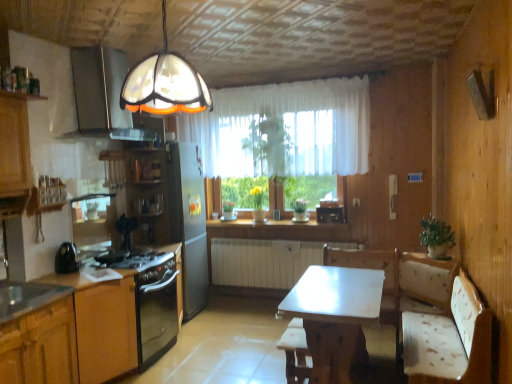
What is the approximate width of white glossy countertop at center?

The width of white glossy countertop at center is 14.56 inches.

In order to face wooden radio at center, should I rotate leftwards or rightwards?

A 10.025 degree turn to the right will do.

Locate an element on the screen. wooden cabinet at lower left, which is counted as the 1th cabinetry, starting from the front is located at coordinates (40, 346).

Consider the image. Is white sheer curtain at center thinner than translucent glass lampshade at upper center?

Yes.

Considering the sizes of objects white sheer curtain at center and translucent glass lampshade at upper center in the image provided, who is smaller, white sheer curtain at center or translucent glass lampshade at upper center?

translucent glass lampshade at upper center.

From the image's perspective, which is above, white sheer curtain at center or translucent glass lampshade at upper center?

From the image's view, translucent glass lampshade at upper center is above.

Considering the sizes of objects wooden radio at center and wooden cabinet at lower left, marked as the 2th cabinetry in a back-to-front arrangement, in the image provided, who is thinner, wooden radio at center or wooden cabinet at lower left, marked as the 2th cabinetry in a back-to-front arrangement,?

With smaller width is wooden radio at center.

Is wooden radio at center at the left side of wooden cabinet at lower left, marked as the 2th cabinetry in a back-to-front arrangement?

No.

Does wooden radio at center turn towards wooden cabinet at lower left, which is counted as the 1th cabinetry, starting from the front?

No, wooden radio at center is not facing towards wooden cabinet at lower left, which is counted as the 1th cabinetry, starting from the front.

At what (x,y) coordinates should I click in order to perform the action: click on sink located above the wooden cabinet at left, arranged as the 2th cabinetry when viewed from the front (from the image's perspective). Please return your answer as a coordinate pair (x, y). Looking at the image, I should click on (27, 298).

Is metallic stainless steel sink at lower left to the right of wooden cabinet at left, the 1th cabinetry in the back-to-front sequence, from the viewer's perspective?

No, metallic stainless steel sink at lower left is not to the right of wooden cabinet at left, the 1th cabinetry in the back-to-front sequence.

Is metallic stainless steel sink at lower left bigger than wooden cabinet at left, arranged as the 2th cabinetry when viewed from the front?

No, metallic stainless steel sink at lower left is not bigger than wooden cabinet at left, arranged as the 2th cabinetry when viewed from the front.

Which of these two, white glossy countertop at center or wooden cabinet at left, the 1th cabinetry in the back-to-front sequence, stands shorter?

white glossy countertop at center is shorter.

From a real-world perspective, which object rests below the other?

In real-world perspective, wooden cabinet at left, arranged as the 2th cabinetry when viewed from the front, is lower.

Which of these two, white glossy countertop at center or wooden cabinet at left, the 1th cabinetry in the back-to-front sequence, is smaller?

Smaller between the two is white glossy countertop at center.

From the image's perspective, between wooden radio at center and white glossy table at center, who is located below?

white glossy table at center is shown below in the image.

Considering the sizes of wooden radio at center and white glossy table at center in the image, is wooden radio at center taller or shorter than white glossy table at center?

Considering their sizes, wooden radio at center has less height than white glossy table at center.

Is white glossy table at center at the back of wooden radio at center?

No, wooden radio at center is not facing away from white glossy table at center.

Is wooden radio at center positioned behind white glossy table at center?

Yes.

From the image's perspective, relative to wooden radio at center, is wooden cabinet at left, arranged as the 2th cabinetry when viewed from the front, above or below?

wooden cabinet at left, arranged as the 2th cabinetry when viewed from the front, is below wooden radio at center.

In the scene shown: Is wooden cabinet at left, arranged as the 2th cabinetry when viewed from the front, outside of wooden radio at center?

Yes, wooden cabinet at left, arranged as the 2th cabinetry when viewed from the front, is located beyond the bounds of wooden radio at center.

Is wooden cabinet at left, the 1th cabinetry in the back-to-front sequence, next to wooden radio at center?

No, wooden cabinet at left, the 1th cabinetry in the back-to-front sequence, is not beside wooden radio at center.

From the image's perspective, which object appears higher, white glossy table at center or black matte gas stove at lower left?

black matte gas stove at lower left.

Is the depth of white glossy table at center less than that of black matte gas stove at lower left?

Yes, white glossy table at center is closer to the viewer.

From a real-world perspective, relative to black matte gas stove at lower left, is white glossy table at center vertically above or below?

white glossy table at center is below black matte gas stove at lower left.

Image resolution: width=512 pixels, height=384 pixels. What are the coordinates of `window located underneath the translucent glass lampshade at upper center (from a real-world perspective)` in the screenshot? It's located at (286, 127).

Where is `the 2nd cabinetry below when counting from the wooden radio at center (from the image's perspective)`? the 2nd cabinetry below when counting from the wooden radio at center (from the image's perspective) is located at coordinates (40, 346).

Based on their spatial positions, is white sheer curtain at center or wooden cabinet at lower left, marked as the 2th cabinetry in a back-to-front arrangement, further from translucent glass lampshade at upper center?

Based on the image, white sheer curtain at center appears to be further to translucent glass lampshade at upper center.

Which object lies nearer to the anchor point wooden radio at center, black matte gas stove at lower left or white glossy table at center?

white glossy table at center is positioned closer to the anchor wooden radio at center.

Based on their spatial positions, is wooden bar stool at center or matte glass exhaust hood at upper left further from white glossy countertop at center?

wooden bar stool at center lies further to white glossy countertop at center than the other object.

Based on their spatial positions, is black matte gas stove at lower left or wooden cabinet at lower left, marked as the 2th cabinetry in a back-to-front arrangement, closer to matte glass exhaust hood at upper left?

black matte gas stove at lower left is closer to matte glass exhaust hood at upper left.

Consider the image. Looking at the image, which one is located closer to wooden cabinet at lower left, marked as the 2th cabinetry in a back-to-front arrangement, matte glass exhaust hood at upper left or translucent glass lampshade at upper center?

The object closer to wooden cabinet at lower left, marked as the 2th cabinetry in a back-to-front arrangement, is translucent glass lampshade at upper center.

Considering their positions, is wooden cabinet at left, the 1th cabinetry in the back-to-front sequence, positioned closer to wooden cabinet at lower left, marked as the 2th cabinetry in a back-to-front arrangement, than white glossy table at center?

wooden cabinet at left, the 1th cabinetry in the back-to-front sequence.

Considering their positions, is white sheer curtain at center positioned further to wooden cabinet at left, arranged as the 2th cabinetry when viewed from the front, than wooden radio at center?

Among the two, wooden radio at center is located further to wooden cabinet at left, arranged as the 2th cabinetry when viewed from the front.

Estimate the real-world distances between objects in this image. Which object is closer to black glossy kettle at left, wooden cabinet at lower left, marked as the 2th cabinetry in a back-to-front arrangement, or white glossy countertop at center?

wooden cabinet at lower left, marked as the 2th cabinetry in a back-to-front arrangement.

I want to click on table between white sheer curtain at center and wooden bar stool at center from top to bottom, so click(332, 319).

The width and height of the screenshot is (512, 384). What are the coordinates of `bar stool between wooden cabinet at lower left, marked as the 2th cabinetry in a back-to-front arrangement, and white glossy countertop at center in the front-back direction` in the screenshot? It's located at (295, 352).

I want to click on cabinetry between white sheer curtain at center and white glossy table at center in the up-down direction, so click(x=88, y=324).

Identify the location of countertop between black glossy kettle at left and wooden radio at center from left to right. (273, 224).